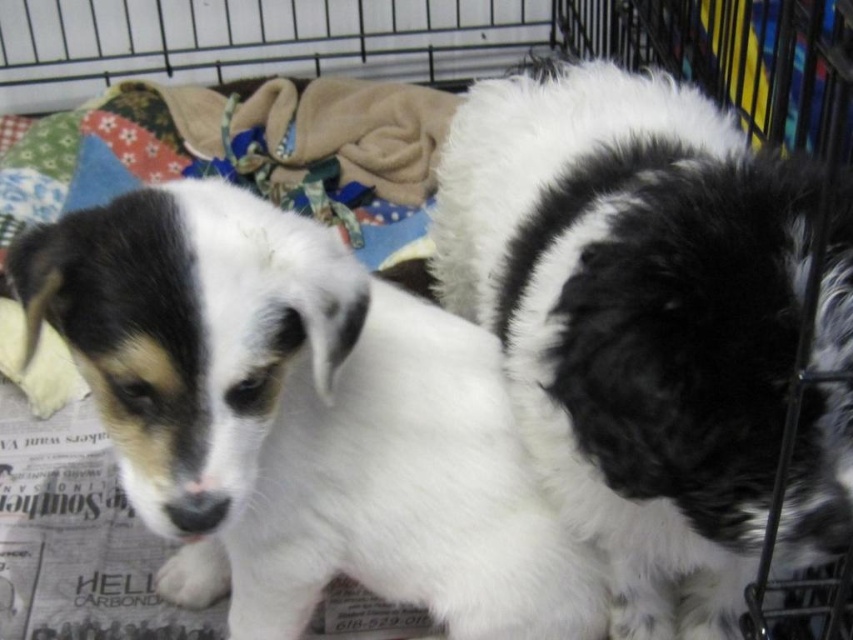
You are a veterinarian examining two puppies in a kennel. You notice the white fluffy dog at center and the white fur dog at center. Which puppy is closer to you?

The white fluffy dog at center is closer to you because it is positioned in front of the white fur dog at center.

You are a dog owner who wants to place a new toy for your dog in the kennel. The toy needs to be placed between the white fur dog at center and the fluffy fleece blanket at upper left. Where should you place the toy?

The toy should be placed between the white fur dog at center and the fluffy fleece blanket at upper left, which are positioned such that the white fur dog at center is to the right of the fluffy fleece blanket at upper left.